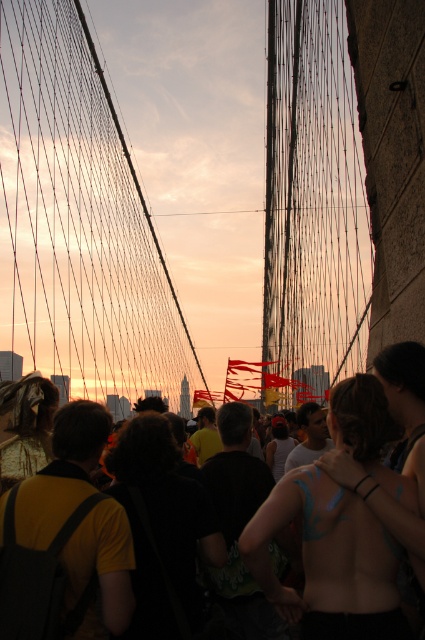
You are a photographer trying to capture a photo of the body paint at center and the yellow matte shirt at lower left. Based on their positions, which object is closer to the camera?

The body paint at center is below the yellow matte shirt at lower left, so the yellow matte shirt at lower left is closer to the camera.

You are standing on the Brooklyn Bridge during sunset and see both the body paint at center and the dark yellow shirt at center. Which object is nearer to you?

The body paint at center is closer to the viewer than the dark yellow shirt at center.

You are an artist planning to sketch the Brooklyn Bridge scene. You want to ensure the black wire suspension bridge at center and the body paint at center are proportionally accurate. Based on the scene, which object should be drawn larger in your sketch?

The black wire suspension bridge at center should be drawn larger than the body paint at center because it has a larger size compared to the body paint at center according to the description.